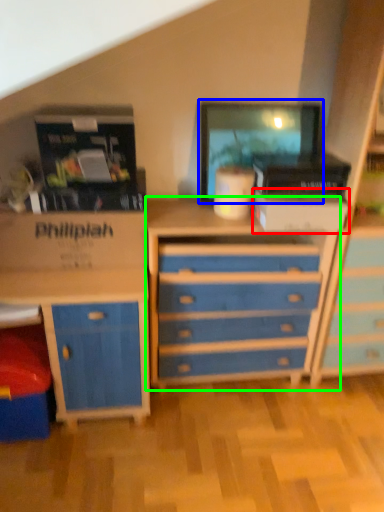
Question: Considering the real-world distances, which object is closest to storage box (highlighted by a red box)? computer monitor (highlighted by a blue box) or chest of drawers (highlighted by a green box).

Choices:
 (A) computer monitor
 (B) chest of drawers

Answer: (A)